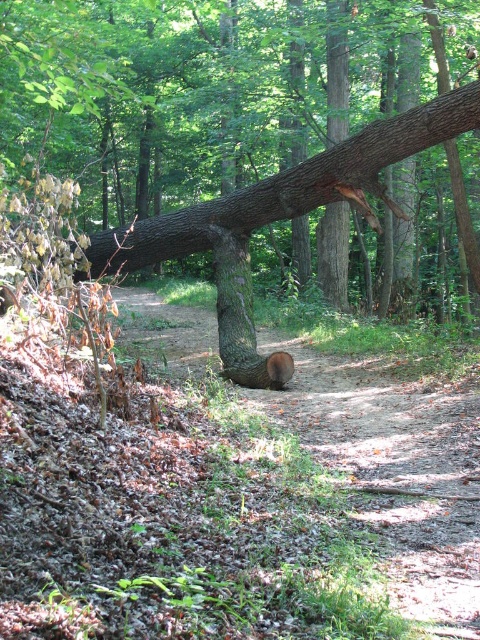
You are a hiker carrying a backpack and need to cross the dirt path in the forest. You see the brown rough tree stump at center and the brown rough tree trunk at center blocking your way. Which object should you step over to avoid getting your shoes dirty?

The brown rough tree stump at center might be wider than the brown rough tree trunk at center, so stepping over the stump would be easier and less likely to get your shoes dirty since it provides a wider surface to step on.

You are a hiker carrying a backpack and need to cross the dirt path blocked by the brown rough tree stump at center and the smooth brown log at center. The path is 1.5 meters wide. Can you walk between them without stepping off the path?

The brown rough tree stump at center and smooth brown log at center are 1.26 meters apart. Since the path is 1.5 meters wide, you can walk between them without stepping off the path as the distance between them is narrower than the path width.

You are a hiker trying to cross the forest path blocked by two large objects. You see the smooth brown log at center and the brown rough tree trunk at center. Which object should you avoid stepping on to ensure stability?

The smooth brown log at center is bigger than the brown rough tree trunk at center, so stepping on the smooth brown log at center would provide more stability due to its larger size.